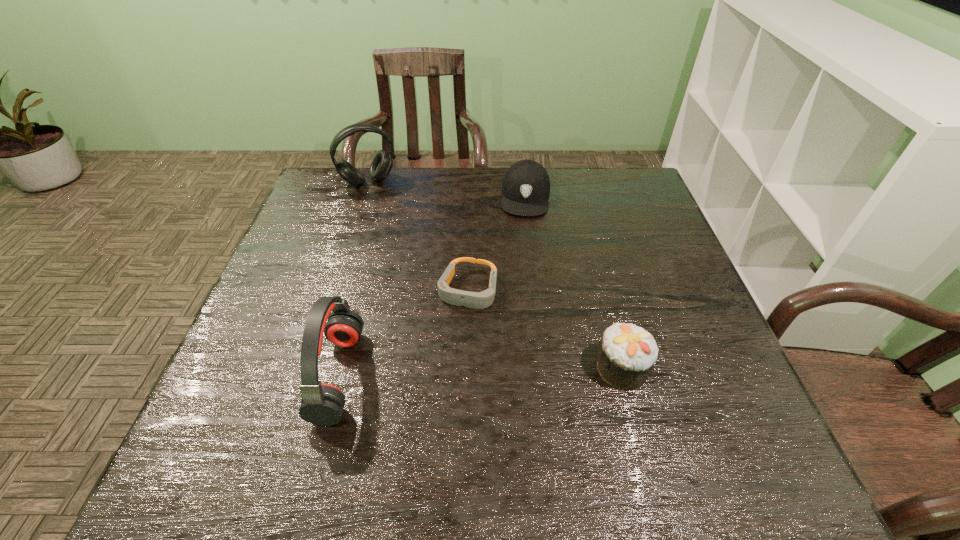
Choose which object is the nearest neighbor to the headset. Please provide its 2D coordinates. Your answer should be formatted as a tuple, i.e. [(x, y)], where the tuple contains the x and y coordinates of a point satisfying the conditions above.

[(526, 185)]

Locate an element on the screen. free point that satisfies the following two spatial constraints: 1. on the front side of the headset; 2. on the ear cups of the earphone is located at coordinates pos(306,375).

The width and height of the screenshot is (960, 540). Find the location of `blank space that satisfies the following two spatial constraints: 1. on the front side of the rightmost object; 2. on the right side of the shortest object`. blank space that satisfies the following two spatial constraints: 1. on the front side of the rightmost object; 2. on the right side of the shortest object is located at coordinates (466, 368).

What are the coordinates of `vacant region that satisfies the following two spatial constraints: 1. on the back side of the goggles; 2. on the right side of the second object from right to left` in the screenshot? It's located at (470, 197).